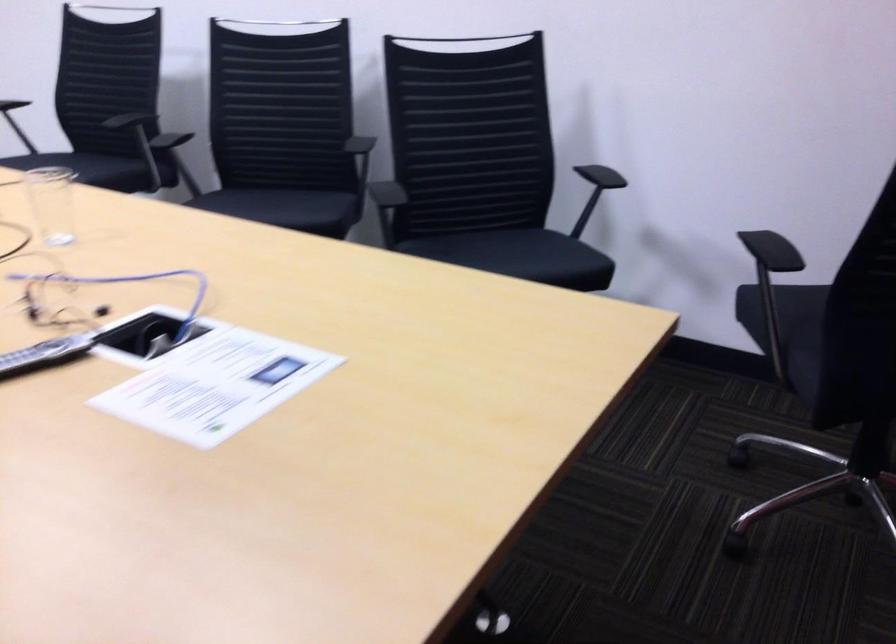
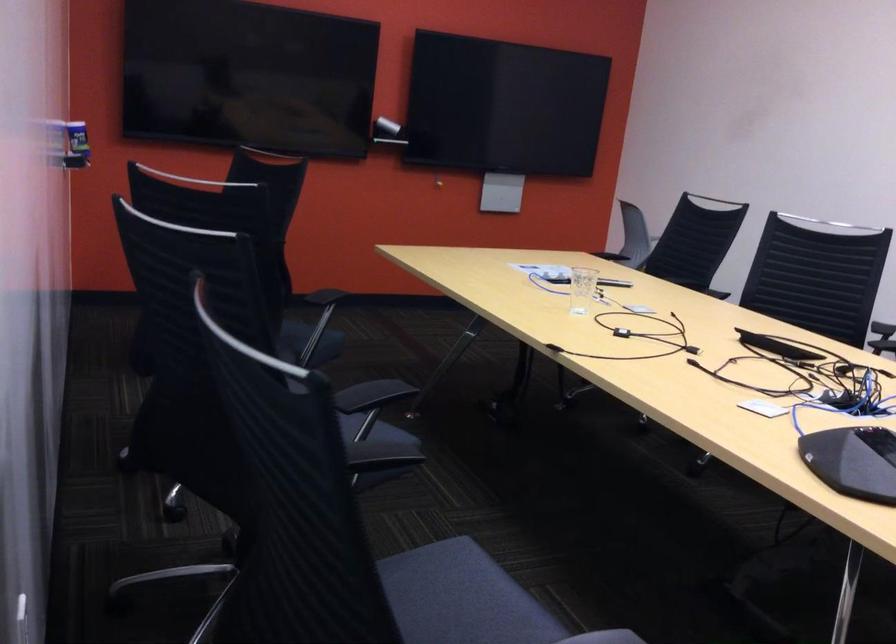
Locate, in the second image, the point that corresponds to point 70,163 in the first image.

(461, 598)